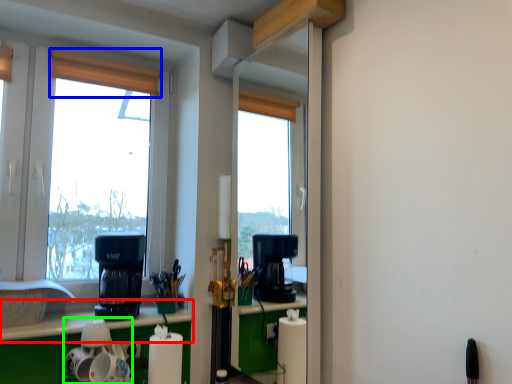
Question: Considering the real-world distances, which object is farthest from counter top (highlighted by a red box)? curtain (highlighted by a blue box) or appliance (highlighted by a green box)?

Choices:
 (A) curtain
 (B) appliance

Answer: (A)